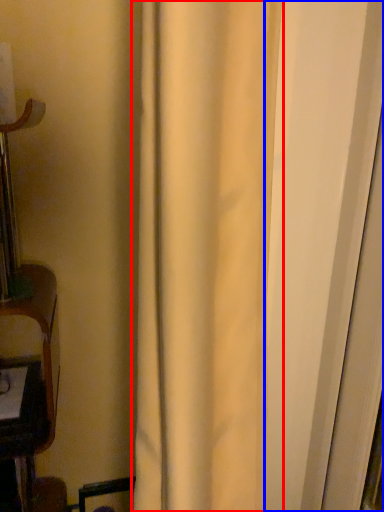
Question: Which object is further to the camera taking this photo, curtain (highlighted by a red box) or screen door (highlighted by a blue box)?

Choices:
 (A) curtain
 (B) screen door

Answer: (B)